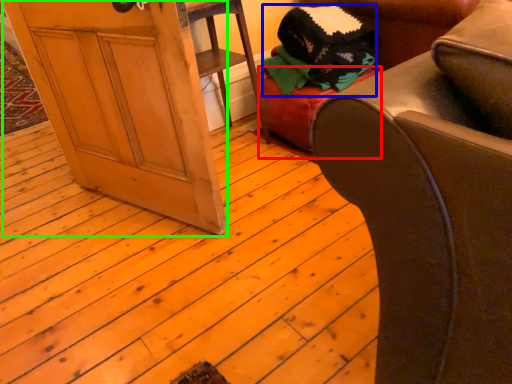
Question: Considering the real-world distances, which object is farthest from stool (highlighted by a red box)? clothing (highlighted by a blue box) or screen door (highlighted by a green box)?

Choices:
 (A) clothing
 (B) screen door

Answer: (B)